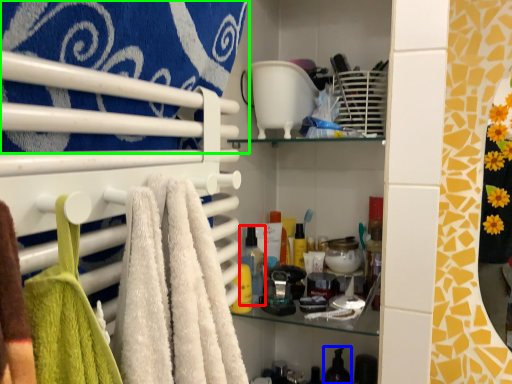
Question: Estimate the real-world distances between objects in this image. Which object is closer to toiletry (highlighted by a red box), toiletry (highlighted by a blue box) or towel (highlighted by a green box)?

Choices:
 (A) toiletry
 (B) towel

Answer: (A)